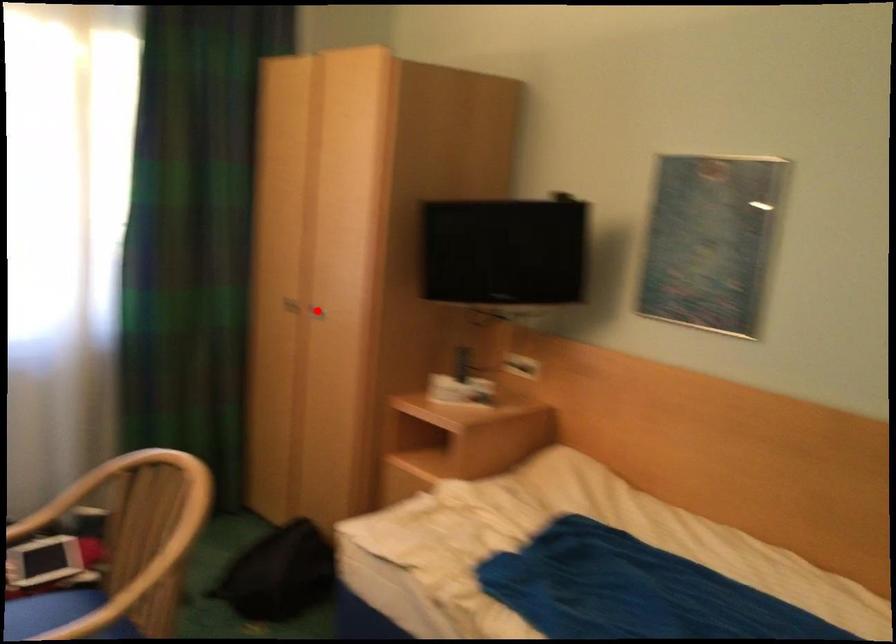
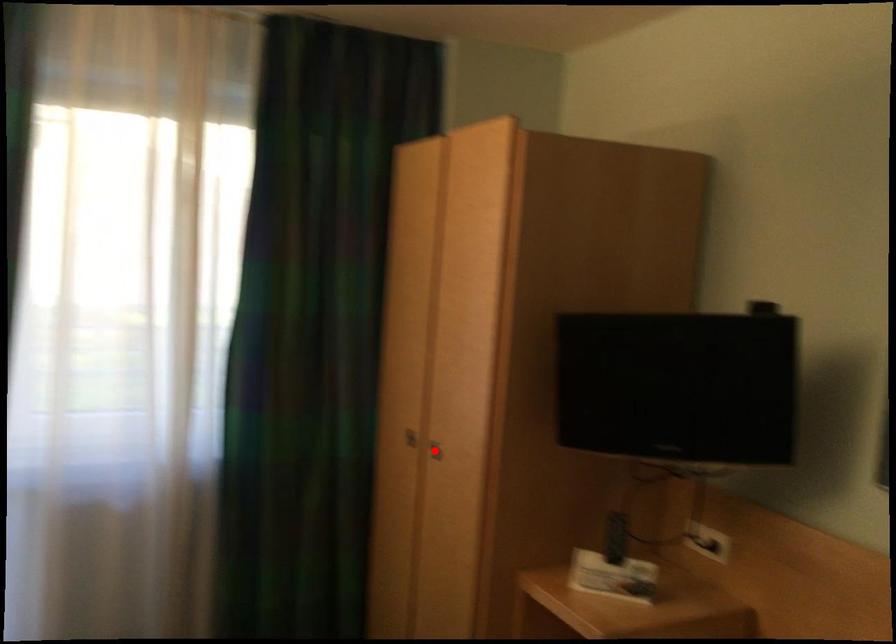
I am providing you with two images of the same scene from different viewpoints. A red point is marked on the first image and another point is marked on the second image. Is the marked point in image1 the same physical position as the marked point in image2?

Yes